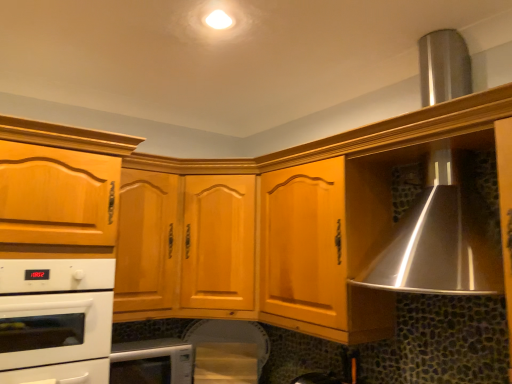
Question: Choose the correct answer: Is light brown wood cabinet at center, which appears as the second cabinetry when viewed from the left, inside matte wood cabinet at left, acting as the second cabinetry starting from the right, or outside it?

Choices:
 (A) inside
 (B) outside

Answer: (B)

Question: Considering their positions, is light brown wood cabinet at center, which appears as the second cabinetry when viewed from the left, located in front of or behind matte wood cabinet at left, acting as the second cabinetry starting from the right?

Choices:
 (A) front
 (B) behind

Answer: (B)

Question: Considering the real-world distances, which object is closest to the matte wood cabinet at left, the first cabinetry positioned from the left?

Choices:
 (A) light brown wood cabinet at center, acting as the 1th cabinetry starting from the right
 (B) white glossy microwave at lower center, the second home appliance positioned from the top
 (C) white glossy oven at lower left, which is the second home appliance from bottom to top

Answer: (C)

Question: Estimate the real-world distances between objects in this image. Which object is closer to the matte wood cabinet at left, acting as the second cabinetry starting from the right?

Choices:
 (A) light brown wood cabinet at center, which appears as the second cabinetry when viewed from the left
 (B) white glossy oven at lower left, which is the second home appliance from bottom to top
 (C) white glossy microwave at lower center, the second home appliance positioned from the top

Answer: (B)